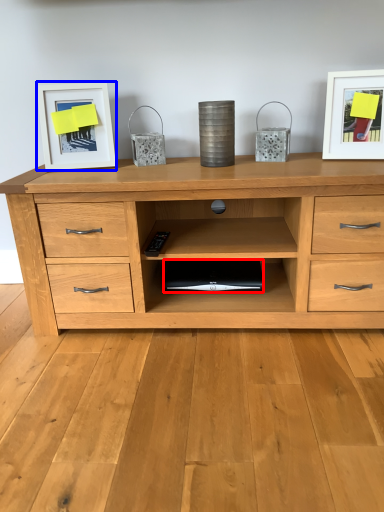
Question: Among these objects, which one is nearest to the camera, computer (highlighted by a red box) or picture frame (highlighted by a blue box)?

Choices:
 (A) computer
 (B) picture frame

Answer: (B)